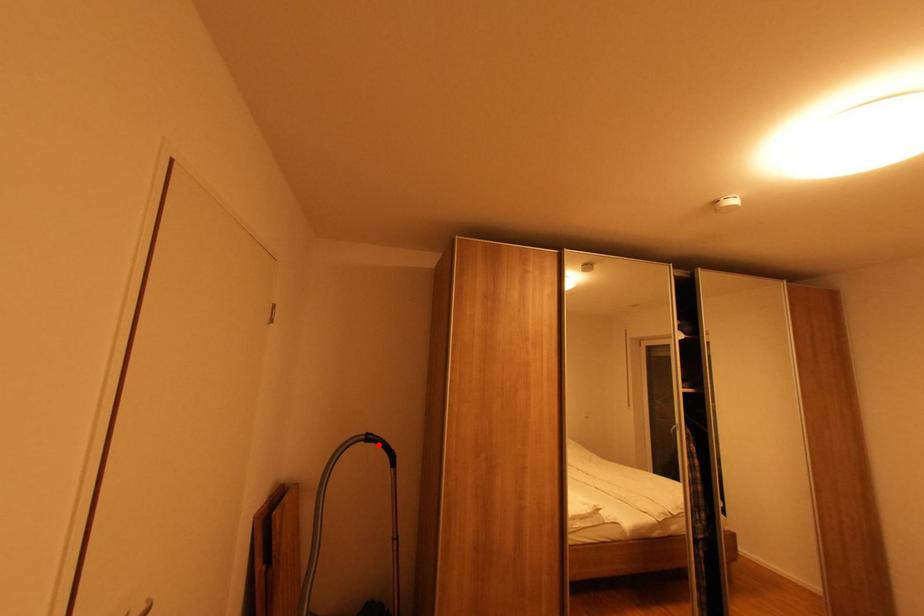
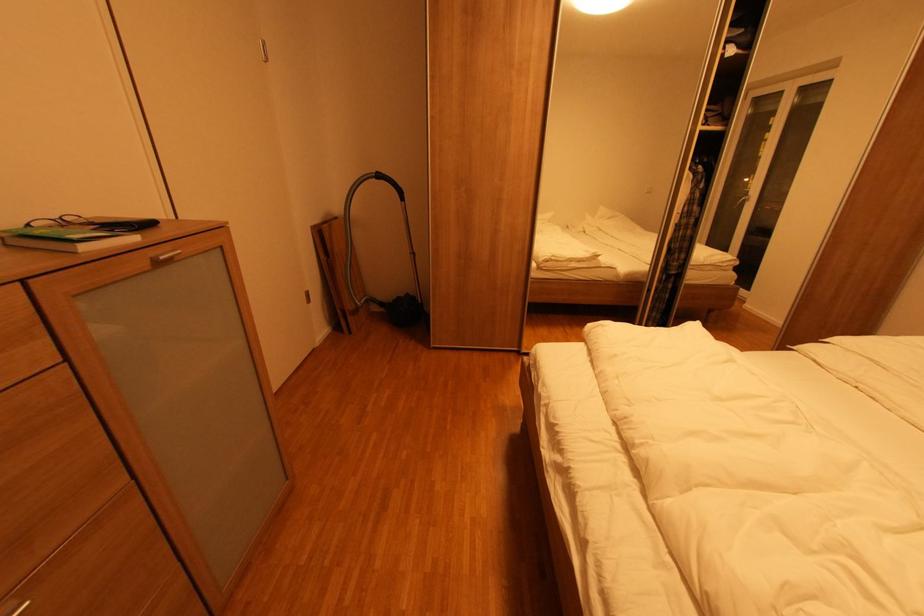
Question: I am providing you with two images of the same scene from different viewpoints. A red point is marked on the first image. At the location where the point appears in image 1, is it still visible in image 2?

Choices:
 (A) Yes
 (B) No

Answer: (A)